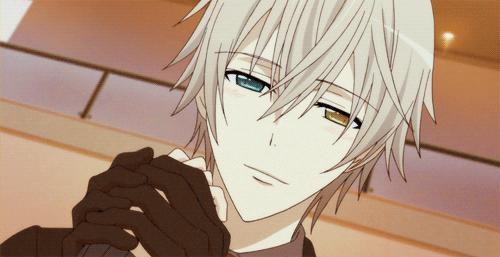
Image resolution: width=500 pixels, height=257 pixels. In order to click on art in this screenshot , I will do click(481, 206).